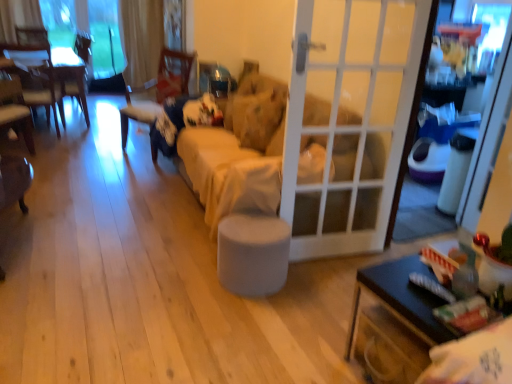
You are a GUI agent. You are given a task and a screenshot of the screen. Output one action in this format:
    pyautogui.click(x=<x>, y=<y>)
    Task: Click on the free space above black glossy table at lower right, positioned as the second table in back-to-front order (from a real-world perspective)
    The width and height of the screenshot is (512, 384).
    Given the screenshot: What is the action you would take?
    pyautogui.click(x=423, y=283)